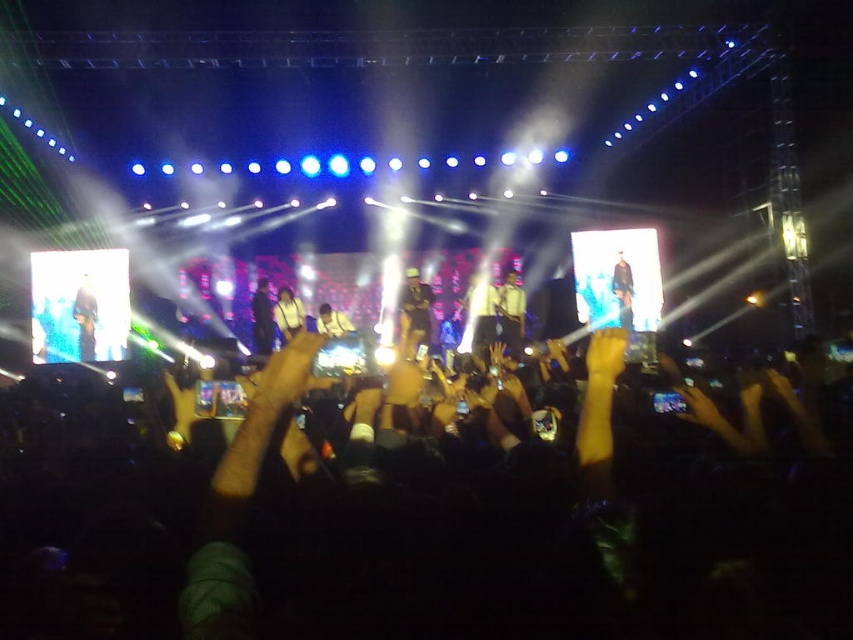
Who is taller, yellow shirt at center or dark blue leather jacket at center?

yellow shirt at center is taller.

Is yellow shirt at center closer to the viewer compared to dark blue leather jacket at center?

Yes, it is in front of dark blue leather jacket at center.

Which is behind, point (511, 326) or point (271, 323)?

The point (511, 326) is more distant.

Locate an element on the screen. The image size is (853, 640). yellow shirt at center is located at coordinates pyautogui.click(x=511, y=312).

Find the location of `white shirt at center`. white shirt at center is located at coordinates (480, 314).

Is white shirt at center thinner than white glossy shirt at center?

Yes.

Does point (480, 307) lie in front of point (282, 320)?

That is False.

Where is `white shirt at center`? white shirt at center is located at coordinates (480, 314).

The width and height of the screenshot is (853, 640). What do you see at coordinates (262, 317) in the screenshot? I see `dark blue leather jacket at center` at bounding box center [262, 317].

This screenshot has width=853, height=640. I want to click on dark blue leather jacket at center, so click(262, 317).

This screenshot has width=853, height=640. I want to click on dark blue leather jacket at center, so click(x=262, y=317).